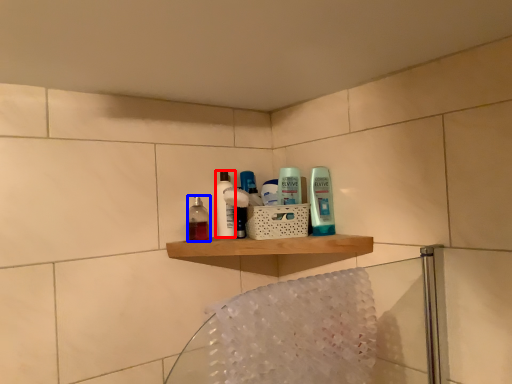
Question: Which object appears closest to the camera in this image, toiletry (highlighted by a red box) or mouthwash (highlighted by a blue box)?

Choices:
 (A) toiletry
 (B) mouthwash

Answer: (B)